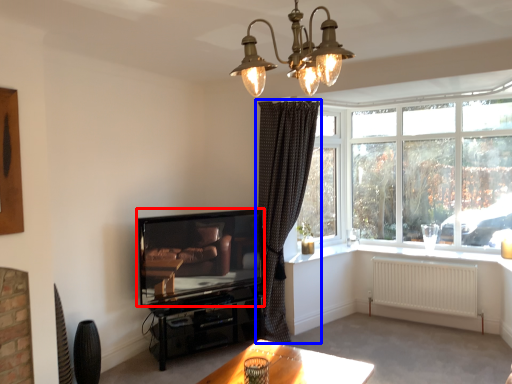
Question: Which object appears closest to the camera in this image, television (highlighted by a red box) or curtain (highlighted by a blue box)?

Choices:
 (A) television
 (B) curtain

Answer: (A)